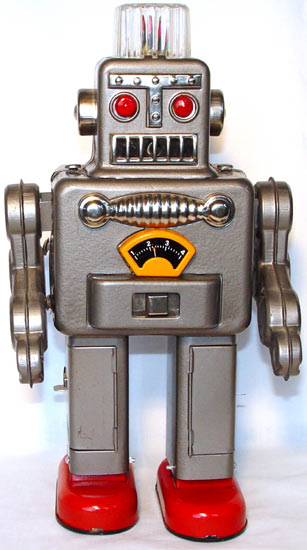
I want to click on light, so click(152, 27).